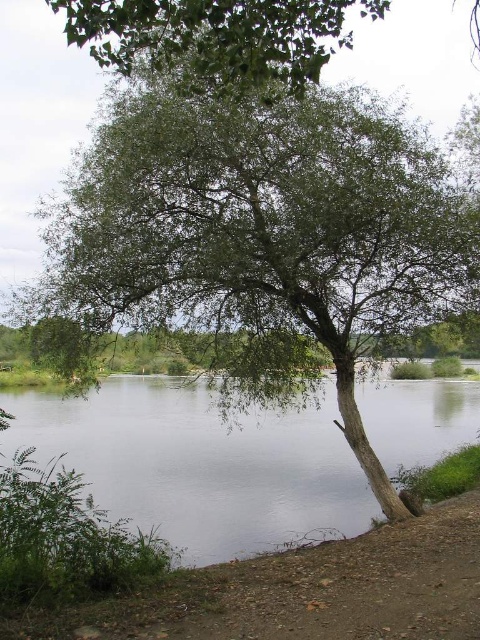
Question: Which object appears closest to the camera in this image?

Choices:
 (A) clear water at center
 (B) green leafy tree at upper center

Answer: (B)

Question: Does clear water at center appear over green leafy tree at upper center?

Choices:
 (A) no
 (B) yes

Answer: (A)

Question: In this image, where is clear water at center located relative to green leafy tree at upper center?

Choices:
 (A) left
 (B) right

Answer: (B)

Question: From the image, what is the correct spatial relationship of clear water at center in relation to green leafy tree at upper center?

Choices:
 (A) above
 (B) below

Answer: (B)

Question: Which point is closer to the camera taking this photo?

Choices:
 (A) (303, 10)
 (B) (254, 424)

Answer: (A)